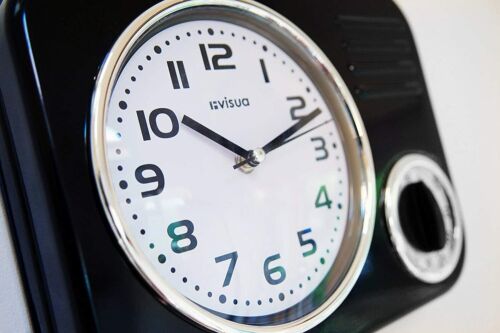
Find the location of a particular element. This screenshot has width=500, height=333. casing is located at coordinates (51, 50).